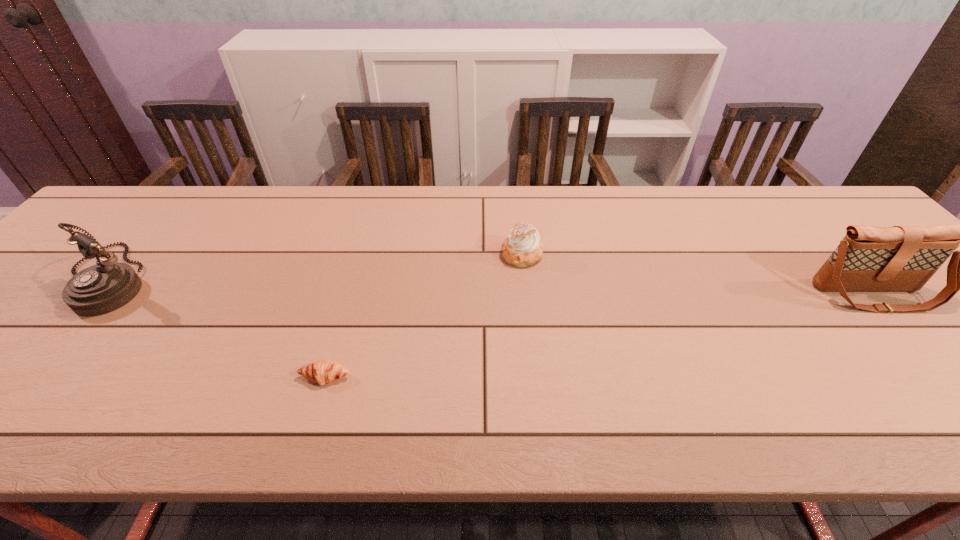
Find the location of a particular element. The height and width of the screenshot is (540, 960). free space between the third object from left to right and the telephone is located at coordinates (317, 266).

Where is `empty space that is in between the nearer pastry and the second shortest object`? The image size is (960, 540). empty space that is in between the nearer pastry and the second shortest object is located at coordinates (423, 316).

At what (x,y) coordinates should I click in order to perform the action: click on free area in between the nearest object and the right pastry. Please return your answer as a coordinate pair (x, y). The height and width of the screenshot is (540, 960). Looking at the image, I should click on (423, 316).

Where is `free point between the telephone and the shorter pastry`? Image resolution: width=960 pixels, height=540 pixels. free point between the telephone and the shorter pastry is located at coordinates (219, 327).

At what (x,y) coordinates should I click in order to perform the action: click on blank region between the second object from right to left and the telephone. Please return your answer as a coordinate pair (x, y). The height and width of the screenshot is (540, 960). Looking at the image, I should click on (317, 266).

At what (x,y) coordinates should I click in order to perform the action: click on free space between the shoulder bag and the second tallest object. Please return your answer as a coordinate pair (x, y). Image resolution: width=960 pixels, height=540 pixels. Looking at the image, I should click on (493, 287).

This screenshot has height=540, width=960. In order to click on free space between the leftmost object and the shoulder bag in this screenshot , I will do `click(493, 287)`.

Locate an element on the screen. unoccupied area between the telephone and the second object from left to right is located at coordinates (219, 327).

Identify the location of object that is the third closest one to the shoulder bag. (x=102, y=288).

Identify the location of the third closest object to the telephone. (901, 258).